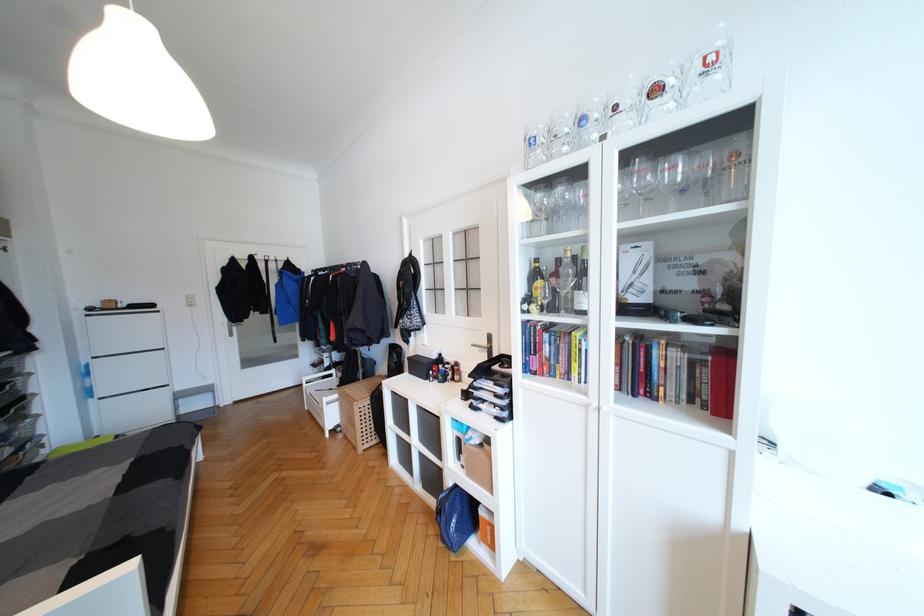
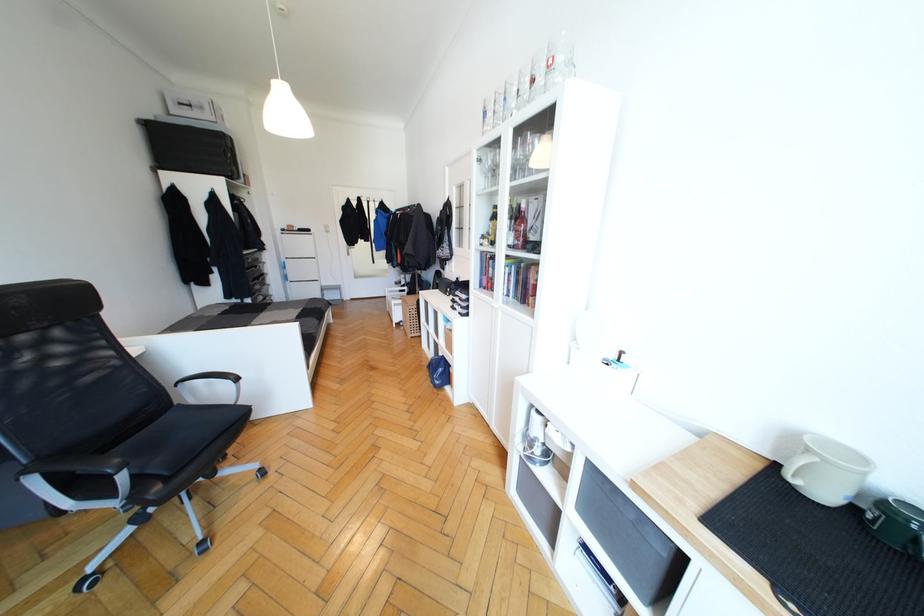
What movement of the cameraman would produce the second image?

The cameraman walked toward right, backward.